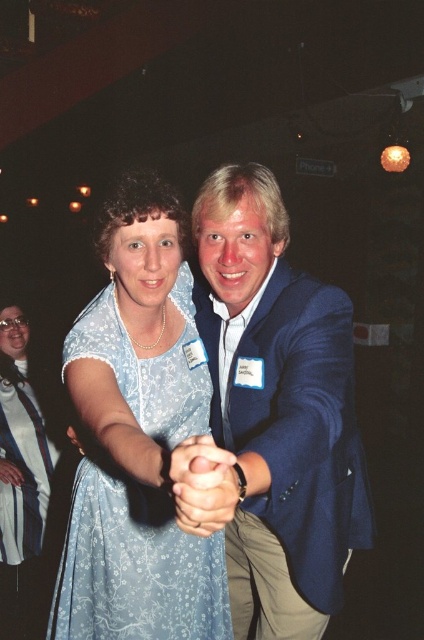
How far apart are blue fabric suit at center and light blue floral dress at center?

blue fabric suit at center and light blue floral dress at center are 10.92 inches apart from each other.

Between point (323, 541) and point (77, 627), which one is positioned behind?

Point (77, 627)

At what (x,y) coordinates should I click in order to perform the action: click on blue fabric suit at center. Please return your answer as a coordinate pair (x, y). The image size is (424, 640). Looking at the image, I should click on (278, 410).

Between blue fabric suit at center and matte blue dress at lower left, which one has less height?

With less height is matte blue dress at lower left.

Looking at this image, does blue fabric suit at center appear on the right side of matte blue dress at lower left?

Indeed, blue fabric suit at center is positioned on the right side of matte blue dress at lower left.

Which is in front, point (225, 216) or point (0, 458)?

Point (225, 216)

Locate an element on the screen. The image size is (424, 640). blue fabric suit at center is located at coordinates (278, 410).

Which is more to the left, smooth skin hand at center or matte blue dress at lower left?

matte blue dress at lower left

Is point (189, 468) closer to camera compared to point (2, 481)?

Yes, point (189, 468) is closer to viewer.

Locate an element on the screen. The width and height of the screenshot is (424, 640). smooth skin hand at center is located at coordinates (203, 484).